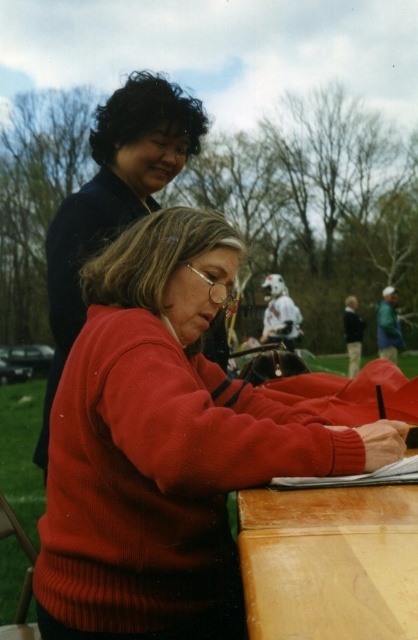
Can you confirm if knitted red sweater at center is bigger than wooden table at lower center?

Yes.

Who is lower down, knitted red sweater at center or wooden table at lower center?

wooden table at lower center

Which is in front, point (163, 440) or point (244, 552)?

Point (244, 552) is more forward.

Where is `knitted red sweater at center`? Image resolution: width=418 pixels, height=640 pixels. knitted red sweater at center is located at coordinates (165, 444).

How much distance is there between wooden table at lower center and matte black sweater at upper left?

A distance of 4.23 feet exists between wooden table at lower center and matte black sweater at upper left.

Who is more forward, (379, 554) or (97, 241)?

Point (379, 554)

Is point (412, 545) behind point (76, 333)?

No, (412, 545) is in front of (76, 333).

The width and height of the screenshot is (418, 640). I want to click on wooden table at lower center, so coord(329,563).

Between knitted red sweater at center and matte black sweater at upper left, which one appears on the left side from the viewer's perspective?

From the viewer's perspective, matte black sweater at upper left appears more on the left side.

Is knitted red sweater at center smaller than matte black sweater at upper left?

Correct, knitted red sweater at center occupies less space than matte black sweater at upper left.

Which is in front, point (114, 348) or point (38, 442)?

Point (114, 348) is more forward.

I want to click on knitted red sweater at center, so click(165, 444).